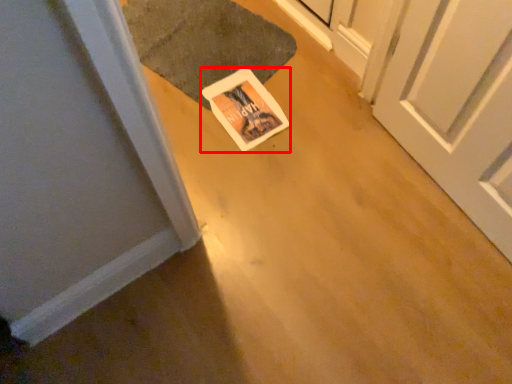
Question: From the image's perspective, where is postcard (annotated by the red box) located relative to doormat?

Choices:
 (A) above
 (B) below

Answer: (B)